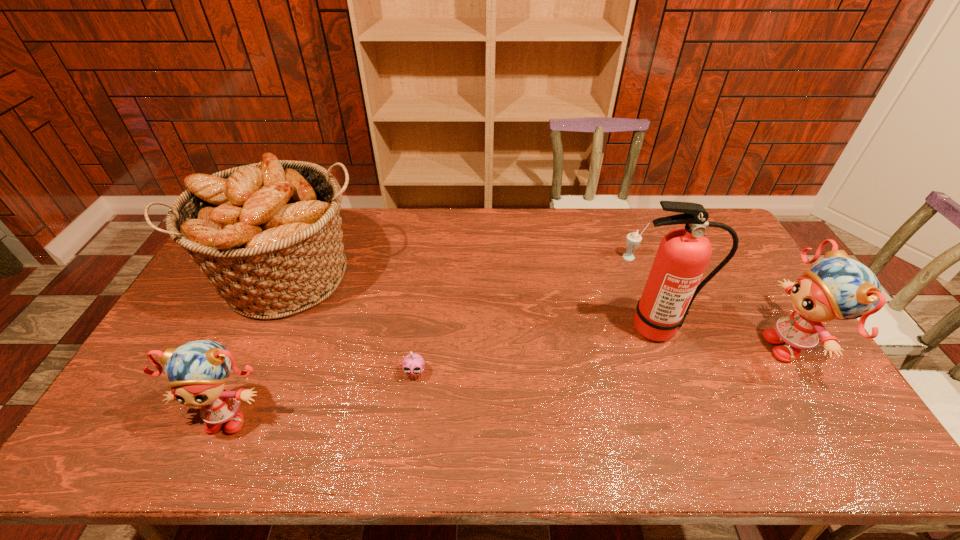
Locate an element on the screen. Image resolution: width=960 pixels, height=540 pixels. the left doll is located at coordinates (197, 371).

Find the location of a particular element. The image size is (960, 540). the shorter doll is located at coordinates (197, 371).

Image resolution: width=960 pixels, height=540 pixels. In order to click on the fourth shortest object in this screenshot , I will do `click(837, 287)`.

Image resolution: width=960 pixels, height=540 pixels. Find the location of `the rightmost object`. the rightmost object is located at coordinates (837, 287).

This screenshot has height=540, width=960. Find the location of `milkshake`. milkshake is located at coordinates (633, 239).

Locate an element on the screen. the fifth shortest object is located at coordinates (268, 235).

At what (x,y) coordinates should I click in order to perform the action: click on the shortest object. Please return your answer as a coordinate pair (x, y). This screenshot has height=540, width=960. Looking at the image, I should click on [x=413, y=364].

I want to click on cupcake, so click(413, 364).

Find the location of a particular element. This screenshot has width=960, height=540. the tallest object is located at coordinates (683, 254).

Where is `vacant region located on the face of the taller doll`? The height and width of the screenshot is (540, 960). vacant region located on the face of the taller doll is located at coordinates click(x=703, y=346).